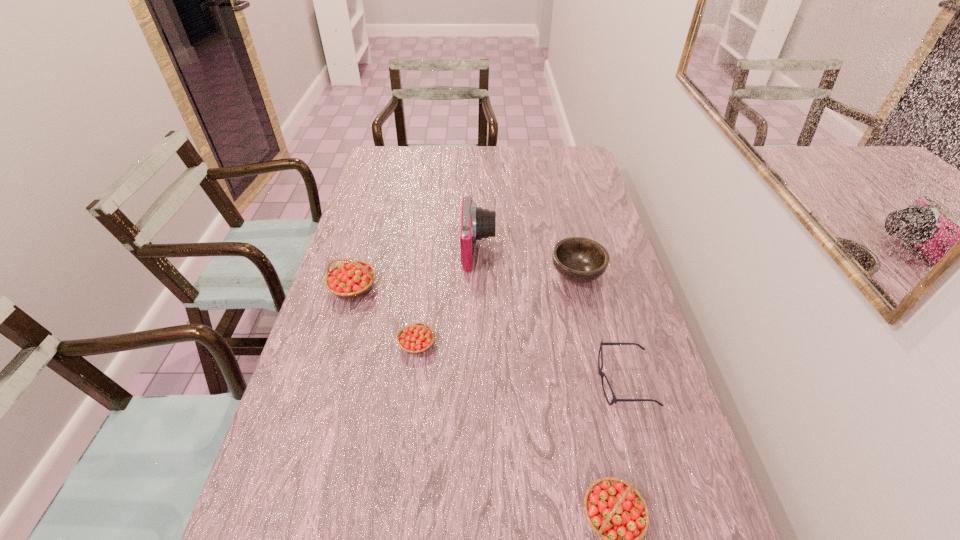
The image size is (960, 540). I want to click on unoccupied area between the second nearest strawberry and the farthest strawberry, so pyautogui.click(x=385, y=316).

Locate an element on the screen. the fourth closest object to the shortest object is located at coordinates (415, 338).

Choose which object is the fourth nearest neighbor to the leftmost strawberry. Please provide its 2D coordinates. Your answer should be formatted as a tuple, i.e. [(x, y)], where the tuple contains the x and y coordinates of a point satisfying the conditions above.

[(602, 374)]

Identify the location of the third closest strawberry to the third object from left to right. (615, 510).

Locate an element on the screen. strawberry that is the second closest one to the bowl is located at coordinates (353, 278).

Where is `free region that satisfies the following two spatial constraints: 1. on the back side of the bowl; 2. on the left side of the second tallest object`? free region that satisfies the following two spatial constraints: 1. on the back side of the bowl; 2. on the left side of the second tallest object is located at coordinates (357, 273).

Identify the location of vacant space that satisfies the following two spatial constraints: 1. on the front-facing side of the bowl; 2. on the right side of the tallest object. This screenshot has width=960, height=540. (479, 273).

In order to click on free space that satisfies the following two spatial constraints: 1. on the front-facing side of the third object from left to right; 2. on the back side of the bowl in this screenshot , I will do `click(479, 273)`.

At what (x,y) coordinates should I click in order to perform the action: click on vacant space that satisfies the following two spatial constraints: 1. on the back side of the bowl; 2. on the left side of the shortest strawberry. Please return your answer as a coordinate pair (x, y). This screenshot has height=540, width=960. Looking at the image, I should click on (426, 273).